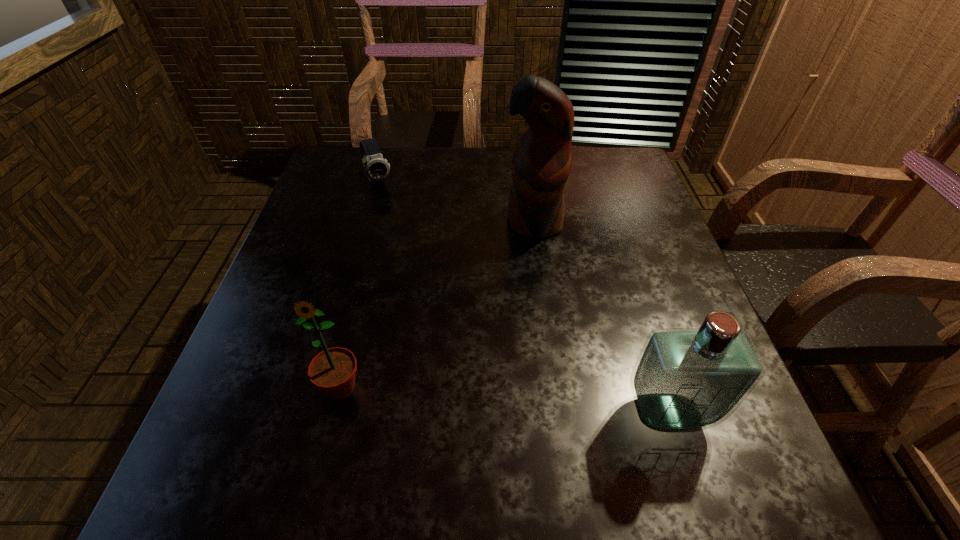
Locate an element on the screen. The image size is (960, 540). vacant space located 0.190m on the face of the tallest object is located at coordinates (509, 303).

The width and height of the screenshot is (960, 540). Find the location of `vacant region located on the face of the tallest object`. vacant region located on the face of the tallest object is located at coordinates (501, 329).

Identify the location of object that is positioned at the far edge. (376, 168).

Find the location of a particular element. Image resolution: width=960 pixels, height=540 pixels. sunflower that is at the near edge is located at coordinates (333, 370).

Locate an element on the screen. The image size is (960, 540). perfume located in the near edge section of the desktop is located at coordinates (685, 379).

Find the location of `sunflower present at the left edge`. sunflower present at the left edge is located at coordinates (333, 370).

The image size is (960, 540). Identify the location of watch that is at the left edge. (376, 168).

Locate an element on the screen. The height and width of the screenshot is (540, 960). object that is at the right edge is located at coordinates (685, 379).

What are the coordinates of `object positioned at the far left corner` in the screenshot? It's located at (376, 168).

You are a GUI agent. You are given a task and a screenshot of the screen. Output one action in this format:
    pyautogui.click(x=<x>, y=<y>)
    Task: Click on the object located in the near left corner section of the desktop
    
    Given the screenshot: What is the action you would take?
    pyautogui.click(x=333, y=370)